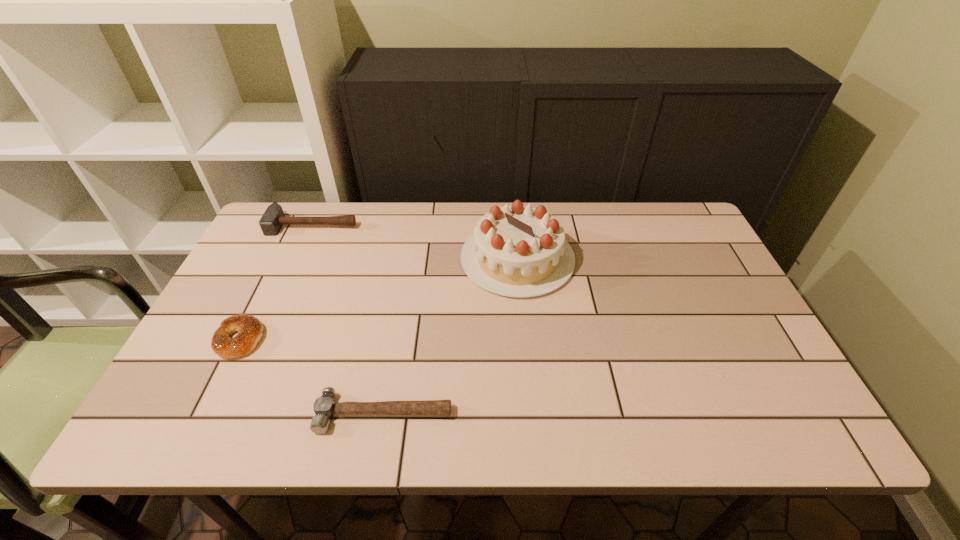
Where is `empty space that is in between the bagel and the left hammer`? Image resolution: width=960 pixels, height=540 pixels. empty space that is in between the bagel and the left hammer is located at coordinates (276, 282).

Where is `vacant area that lies between the second nearest object and the birthday cake`? vacant area that lies between the second nearest object and the birthday cake is located at coordinates [x=379, y=299].

Where is `object that stands as the closest to the nearer hammer`? object that stands as the closest to the nearer hammer is located at coordinates (249, 328).

Where is `object that is the closest to the second nearest object`? The image size is (960, 540). object that is the closest to the second nearest object is located at coordinates (324, 407).

The height and width of the screenshot is (540, 960). In order to click on vacant space that satisfies the following two spatial constraints: 1. on the striking surface of the farther hammer; 2. on the right side of the birthday cake in this screenshot , I will do `click(298, 259)`.

This screenshot has height=540, width=960. Identify the location of vacant space that satisfies the following two spatial constraints: 1. on the striking surface of the taller hammer; 2. on the left side of the birthday cake. (298, 259).

Where is `vacant region that satisfies the following two spatial constraints: 1. on the striking surface of the taller hammer; 2. on the left side of the birthday cake`? vacant region that satisfies the following two spatial constraints: 1. on the striking surface of the taller hammer; 2. on the left side of the birthday cake is located at coordinates (298, 259).

Where is `free spot that satisfies the following two spatial constraints: 1. on the striking surface of the rightmost object; 2. on the left side of the left hammer`? The image size is (960, 540). free spot that satisfies the following two spatial constraints: 1. on the striking surface of the rightmost object; 2. on the left side of the left hammer is located at coordinates (298, 259).